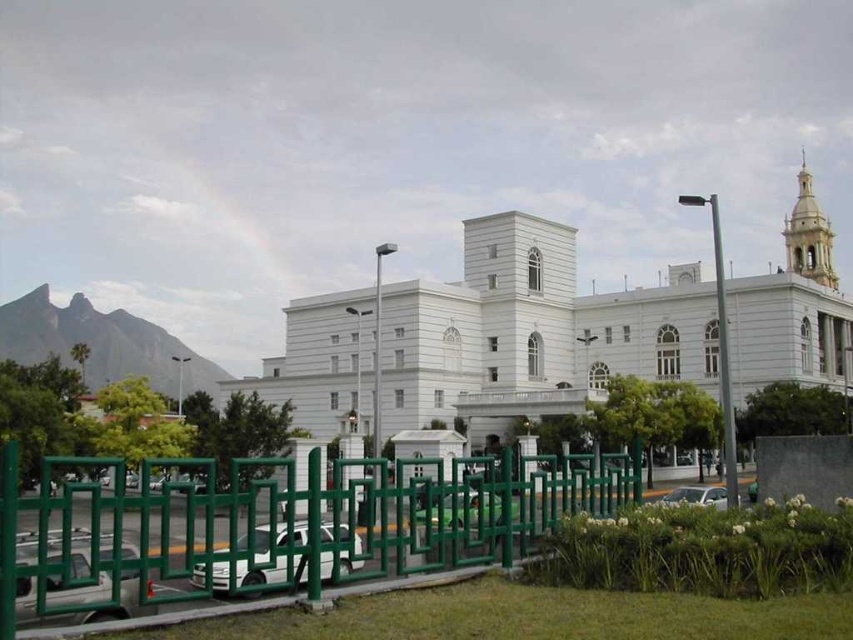
Which is more to the right, white smooth building at center or green metal fence at lower center?

From the viewer's perspective, white smooth building at center appears more on the right side.

Is white smooth building at center shorter than green metal fence at lower center?

No, white smooth building at center is not shorter than green metal fence at lower center.

Does point (573, 296) lie behind point (225, 593)?

Yes, point (573, 296) is farther from viewer.

Image resolution: width=853 pixels, height=640 pixels. In order to click on white smooth building at center in this screenshot , I will do `click(532, 332)`.